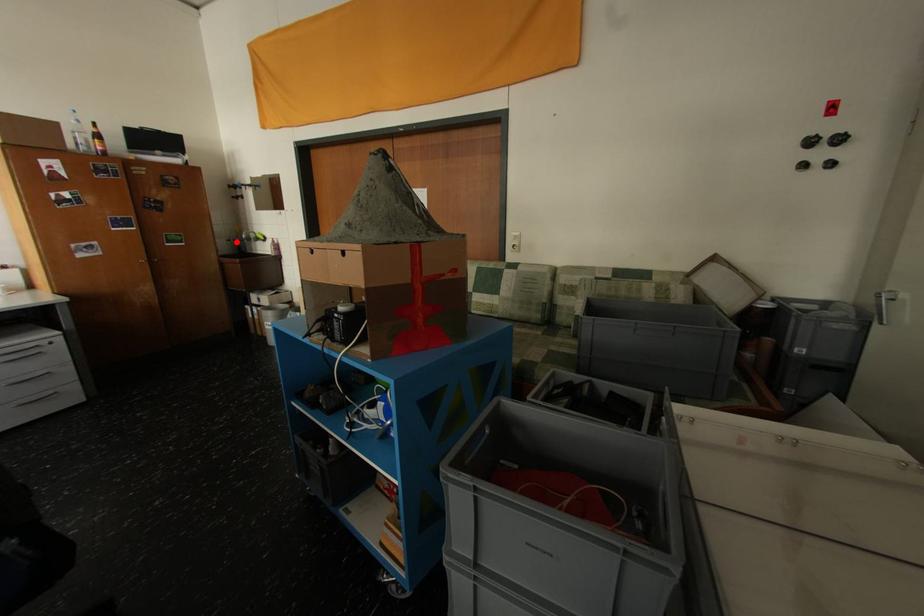
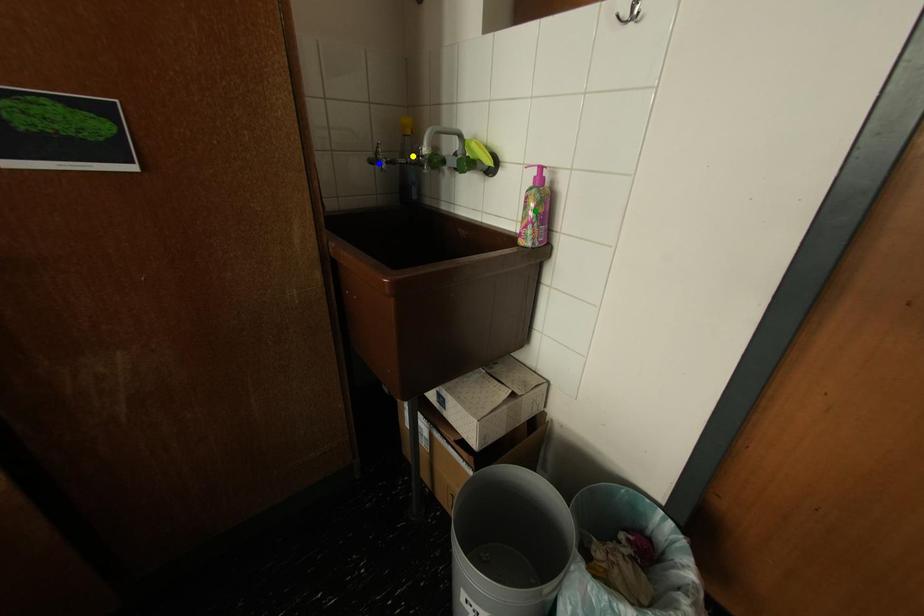
Question: I am providing you with two images of the same scene from different viewpoints. A red point is marked on the first image. You are given multiple points on the second image. In image 2, which mark is for the same physical point as the one in image 1?

Choices:
 (A) yellow point
 (B) green point
 (C) blue point

Answer: (C)